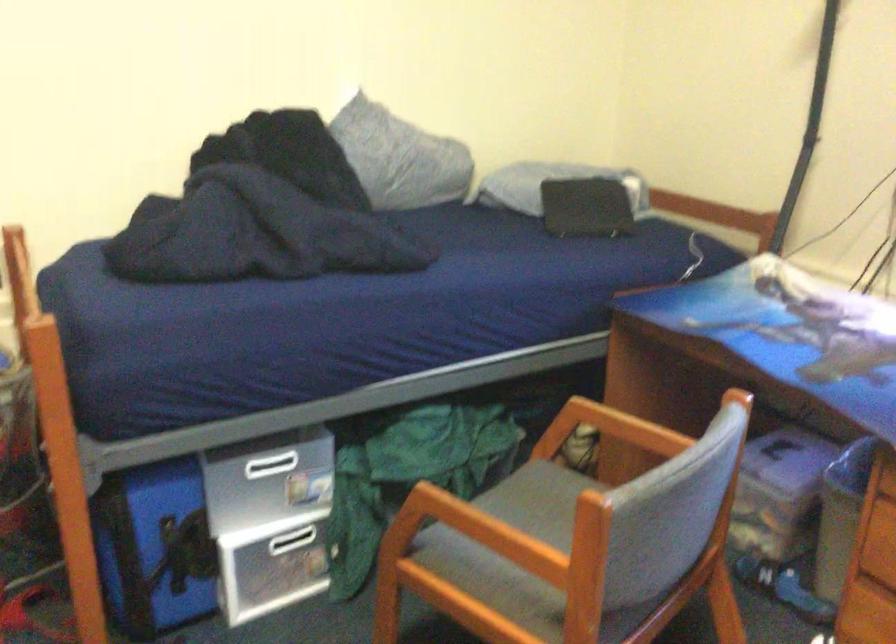
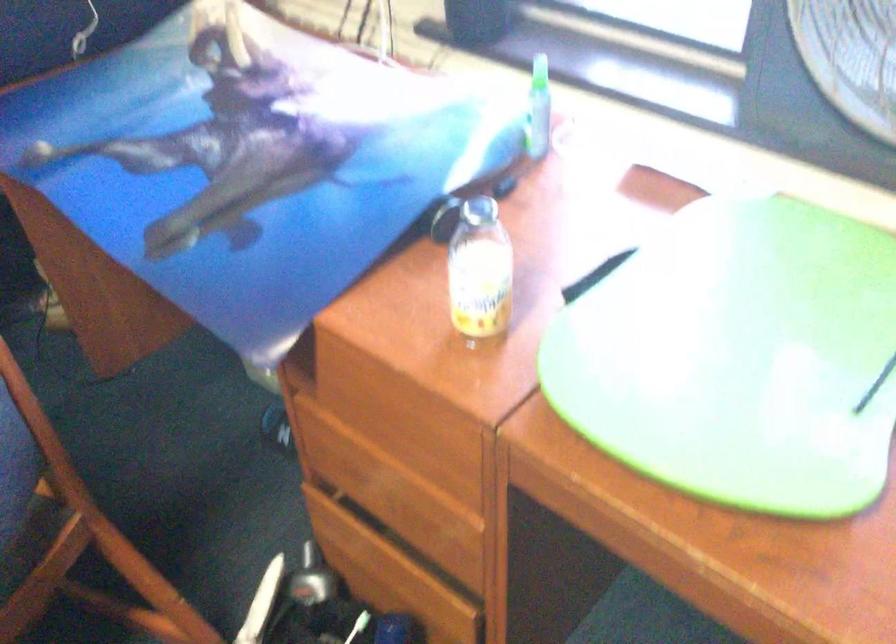
Question: I am providing you with two images of the same scene from different viewpoints. Which of the following objects are not visible in image2?

Choices:
 (A) small plastic bottle
 (B) blue and black shoe
 (C) orange liquid bottle
 (D) silver bottle cap

Answer: (B)